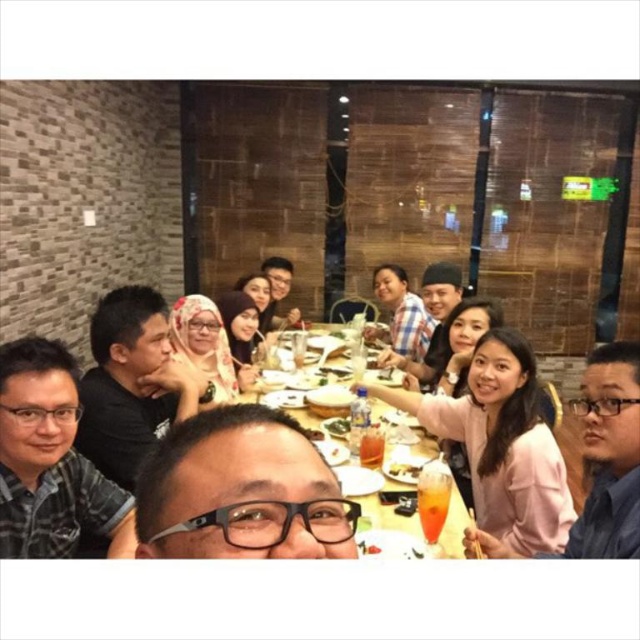
Does point (525, 540) lie in front of point (403, 474)?

Yes, point (525, 540) is in front of point (403, 474).

Is pink fabric shirt at center thinner than yellow matte plate at center?

No.

Is point (419, 404) positioned behind point (419, 465)?

Yes, it is behind point (419, 465).

The image size is (640, 640). I want to click on pink fabric shirt at center, so click(x=500, y=444).

Who is positioned more to the right, pink fabric shirt at center or yellow plastic table at center?

pink fabric shirt at center is more to the right.

Measure the distance from pink fabric shirt at center to yellow plastic table at center.

pink fabric shirt at center and yellow plastic table at center are 12.98 inches apart from each other.

Is point (484, 520) positioned before point (269, 385)?

Yes, it is in front of point (269, 385).

At what (x,y) coordinates should I click in order to perform the action: click on pink fabric shirt at center. Please return your answer as a coordinate pair (x, y). Looking at the image, I should click on coord(500,444).

In the scene shown: Is pink fabric shirt at lower right thinner than yellow plastic table at center?

No, pink fabric shirt at lower right is not thinner than yellow plastic table at center.

Does pink fabric shirt at lower right appear on the left side of yellow plastic table at center?

No, pink fabric shirt at lower right is not to the left of yellow plastic table at center.

Find the location of a particular element. The height and width of the screenshot is (640, 640). pink fabric shirt at lower right is located at coordinates (609, 456).

I want to click on pink fabric shirt at lower right, so click(x=609, y=456).